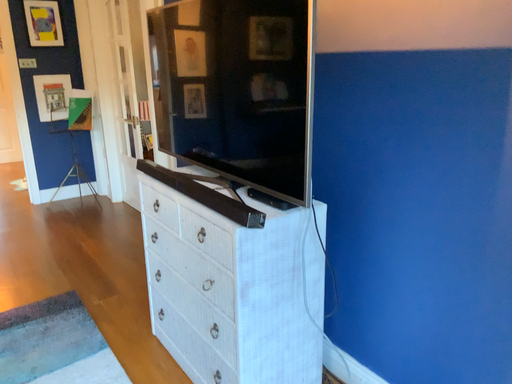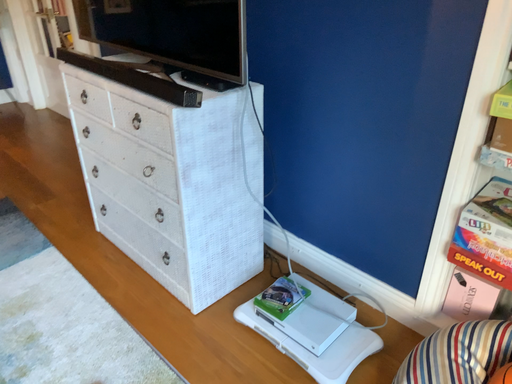
Question: How did the camera likely rotate when shooting the video?

Choices:
 (A) rotated right
 (B) rotated left

Answer: (A)